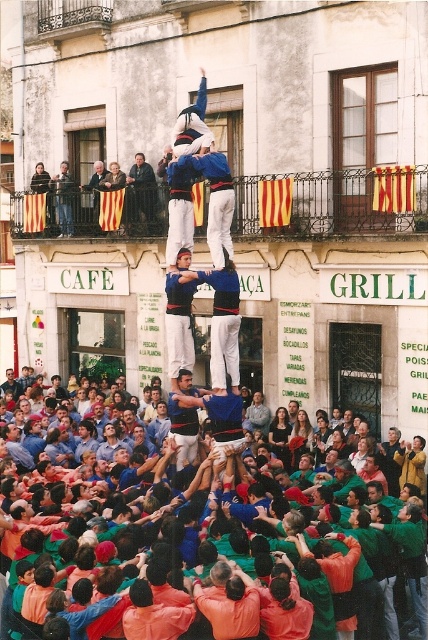
Question: Which of the following is the closest to the observer?

Choices:
 (A) denim jeans at upper left
 (B) orange fabric crowd at center

Answer: (B)

Question: Does dark blue suit at center have a lesser width compared to denim jeans at upper left?

Choices:
 (A) yes
 (B) no

Answer: (B)

Question: Is dark blue suit at center to the left of denim jeans at upper left from the viewer's perspective?

Choices:
 (A) no
 (B) yes

Answer: (A)

Question: Can you confirm if orange fabric crowd at center is positioned to the right of dark blue suit at center?

Choices:
 (A) yes
 (B) no

Answer: (A)

Question: Which point is farther to the camera?

Choices:
 (A) (68, 205)
 (B) (187, 404)

Answer: (A)

Question: Among these objects, which one is farthest from the camera?

Choices:
 (A) dark blue suit at center
 (B) denim jeans at upper left
 (C) orange fabric crowd at center

Answer: (B)